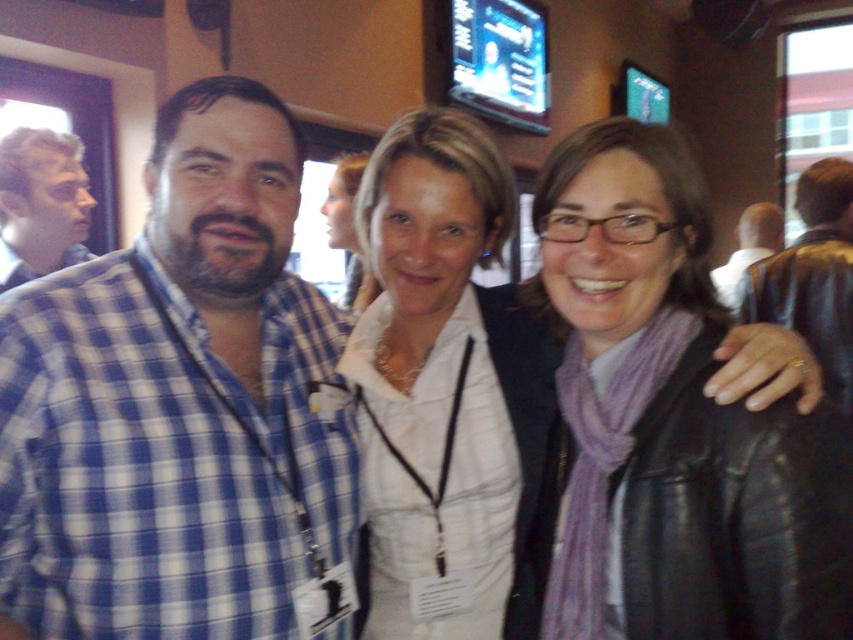
Question: Which object appears closest to the camera in this image?

Choices:
 (A) purple scarf at center
 (B) matte blue shirt at upper left
 (C) white matte shirt at center

Answer: (A)

Question: Among these objects, which one is farthest from the camera?

Choices:
 (A) light brown leather jacket at right
 (B) matte white shirt at center

Answer: (A)

Question: Can you confirm if matte white shirt at center is wider than light brown leather jacket at right?

Choices:
 (A) yes
 (B) no

Answer: (B)

Question: Among these objects, which one is nearest to the camera?

Choices:
 (A) purple scarf at center
 (B) blue plaid shirt at left
 (C) black leather jacket at right

Answer: (B)

Question: Can you confirm if purple scarf at center is wider than matte white shirt at center?

Choices:
 (A) yes
 (B) no

Answer: (A)

Question: Is black leather jacket at right thinner than matte blue shirt at upper left?

Choices:
 (A) no
 (B) yes

Answer: (A)